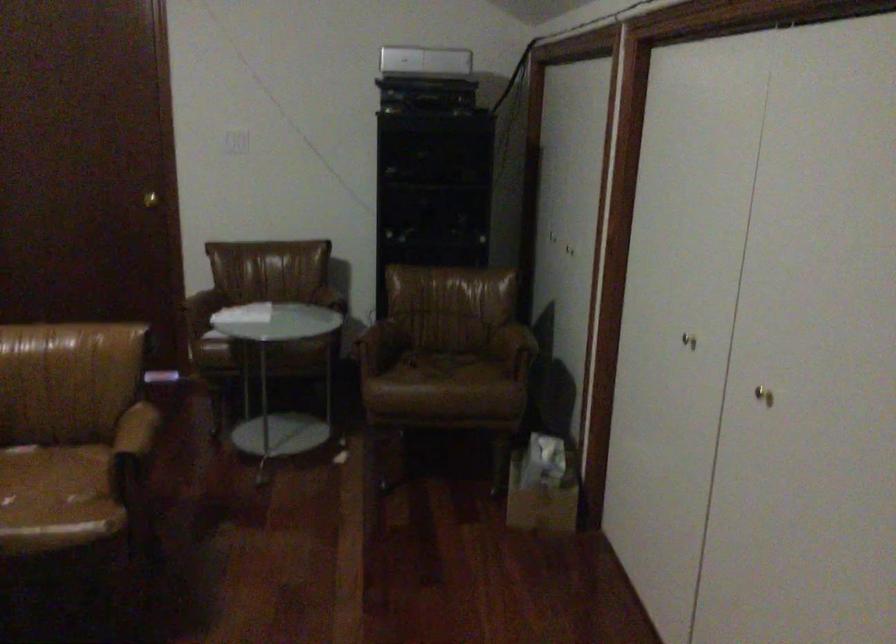
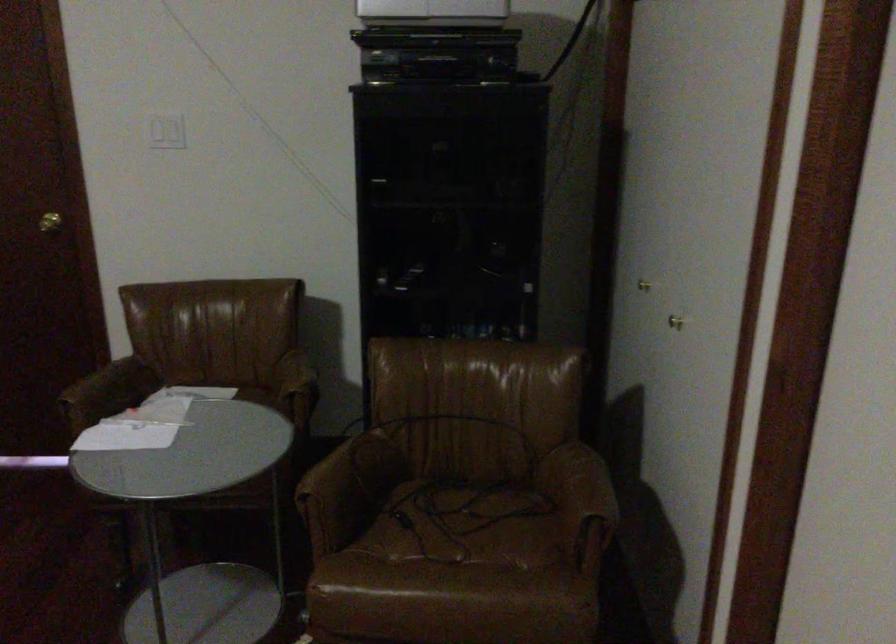
In the second image, find the point that corresponds to the point at 444,366 in the first image.

(464, 525)